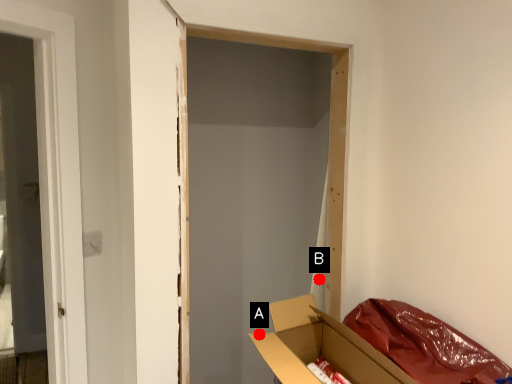
Question: Two points are circled on the image, labeled by A and B beside each circle. Which point is closer to the camera?

Choices:
 (A) A is closer
 (B) B is closer

Answer: (A)